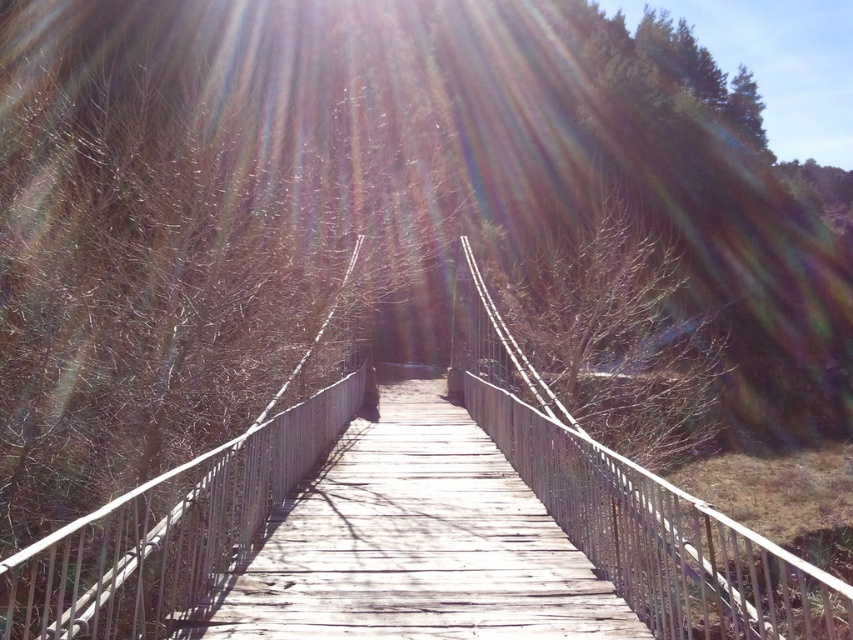
Between weathered wood bridge at center and bare branches at center, which one has less height?

weathered wood bridge at center

Does weathered wood bridge at center have a lesser width compared to bare branches at center?

Correct, weathered wood bridge at center's width is less than bare branches at center's.

Is point (498, 632) farther from camera compared to point (640, 314)?

That is False.

Where is `weathered wood bridge at center`? The image size is (853, 640). weathered wood bridge at center is located at coordinates (415, 544).

Is wooden at center above weathered wood bridge at center?

Actually, wooden at center is below weathered wood bridge at center.

Looking at this image, is wooden at center taller than weathered wood bridge at center?

Correct, wooden at center is much taller as weathered wood bridge at center.

Which is behind, point (515, 465) or point (556, 564)?

The point (515, 465) is behind.

Find the location of a particular element. wooden at center is located at coordinates (635, 508).

Between wooden at center and bare branches at center, which one is positioned lower?

wooden at center

What do you see at coordinates (635, 508) in the screenshot?
I see `wooden at center` at bounding box center [635, 508].

This screenshot has height=640, width=853. What do you see at coordinates (635, 508) in the screenshot?
I see `wooden at center` at bounding box center [635, 508].

The height and width of the screenshot is (640, 853). Find the location of `wooden at center`. wooden at center is located at coordinates (635, 508).